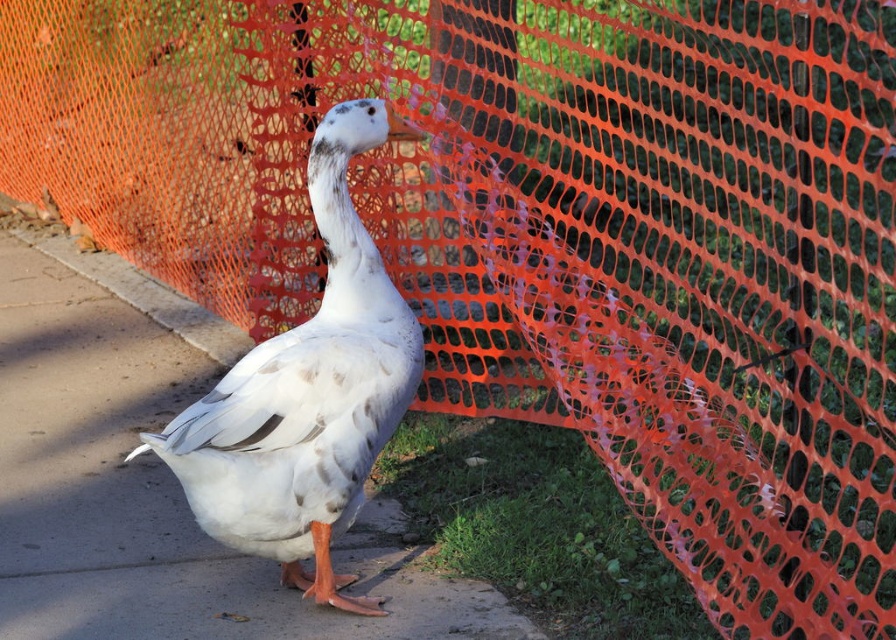
You are a delivery drone flying over the scene. You need to land on the white matte pavement at center. What coordinates should you target for landing?

You should target the coordinates point (158, 484) for landing on the white matte pavement at center.

You are a delivery drone flying over a park. You need to land on the white matte pavement at center to drop off a package. However, there is a white matte duck at center in the way. Can you safely land on the pavement without hitting the duck?

The white matte duck at center is behind the white matte pavement at center, so the duck is not blocking the pavement. You can safely land on the white matte pavement at center without hitting the duck.